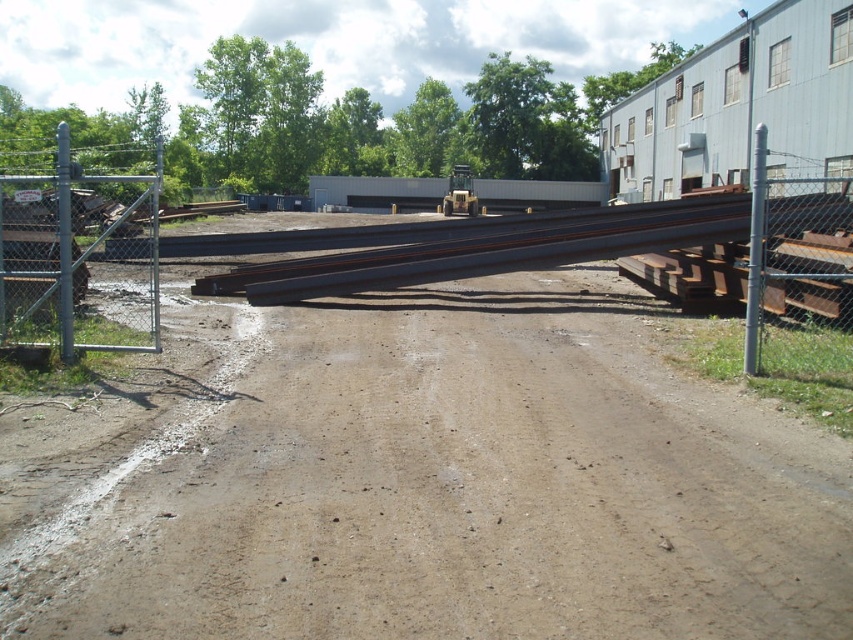
Does brown dirt track at center appear on the left side of rusty metal train track at center?

No, brown dirt track at center is not to the left of rusty metal train track at center.

Which is above, brown dirt track at center or rusty metal train track at center?

rusty metal train track at center is above.

Locate an element on the screen. brown dirt track at center is located at coordinates (471, 490).

Between gray chain-link fence at right and gray metallic pole at right, which one appears on the left side from the viewer's perspective?

Positioned to the left is gray metallic pole at right.

Consider the image. Is gray chain-link fence at right taller than gray metallic pole at right?

No, gray chain-link fence at right is not taller than gray metallic pole at right.

The width and height of the screenshot is (853, 640). In order to click on gray chain-link fence at right in this screenshot , I will do `click(761, 253)`.

Describe the element at coordinates (78, 257) in the screenshot. I see `silver chain-link fence at left` at that location.

Does silver chain-link fence at left lie in front of gray metallic pole at right?

That is False.

Which is in front, point (48, 268) or point (762, 273)?

Positioned in front is point (762, 273).

I want to click on silver chain-link fence at left, so click(78, 257).